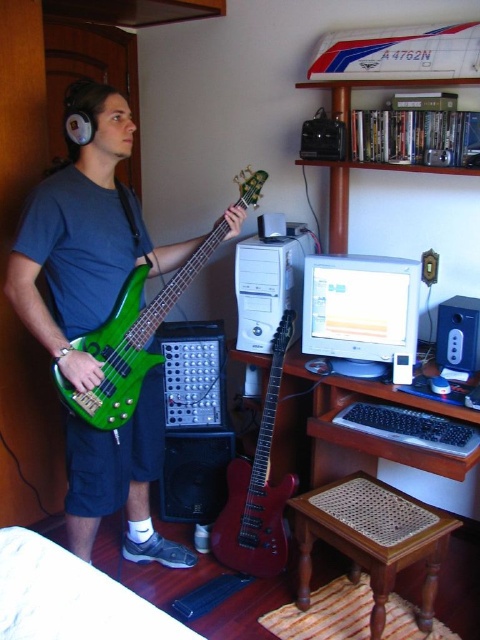
Between point (425, 529) and point (408, 266), which one is positioned in front?

Point (425, 529) is more forward.

In the scene shown: Which is above, brown woven stool at lower center or matte white monitor at center?

matte white monitor at center is higher up.

Between point (373, 563) and point (340, 332), which one is positioned in front?

Point (373, 563) is more forward.

The width and height of the screenshot is (480, 640). Find the location of `brown woven stool at lower center`. brown woven stool at lower center is located at coordinates (372, 540).

Between green glossy bass guitar at center and white plastic desktop computer at center, which one has less height?

white plastic desktop computer at center is shorter.

How far apart are green glossy bass guitar at center and white plastic desktop computer at center?

green glossy bass guitar at center and white plastic desktop computer at center are 16.52 inches apart.

Who is more forward, (x=129, y=417) or (x=262, y=291)?

Positioned in front is point (x=129, y=417).

What are the coordinates of `green glossy bass guitar at center` in the screenshot? It's located at (129, 342).

Between matte white monitor at center and green glossy bass guitar at center, which one is positioned higher?

green glossy bass guitar at center is higher up.

Which is more to the left, matte white monitor at center or green glossy bass guitar at center?

From the viewer's perspective, green glossy bass guitar at center appears more on the left side.

What do you see at coordinates (360, 310) in the screenshot? This screenshot has width=480, height=640. I see `matte white monitor at center` at bounding box center [360, 310].

Where is `matte white monitor at center`? matte white monitor at center is located at coordinates (360, 310).